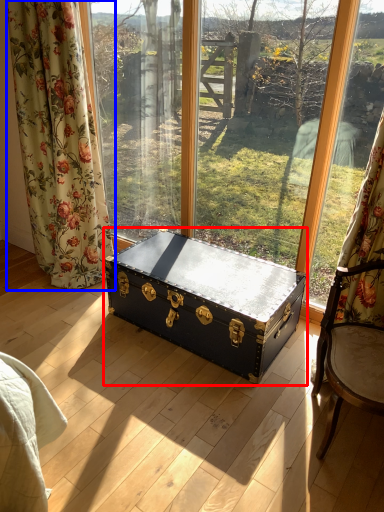
Question: Which point is closer to the camera, table (highlighted by a red box) or curtain (highlighted by a blue box)?

Choices:
 (A) table
 (B) curtain

Answer: (A)